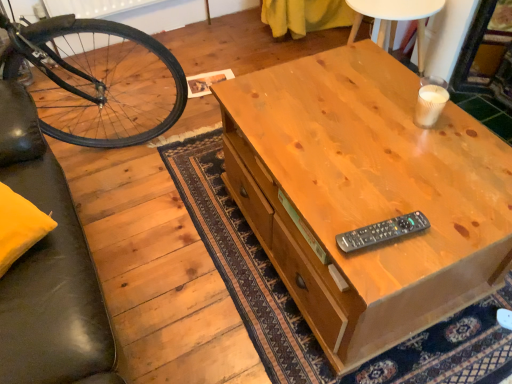
Find the location of a particular element. free space in front of black plastic remote at center is located at coordinates (387, 267).